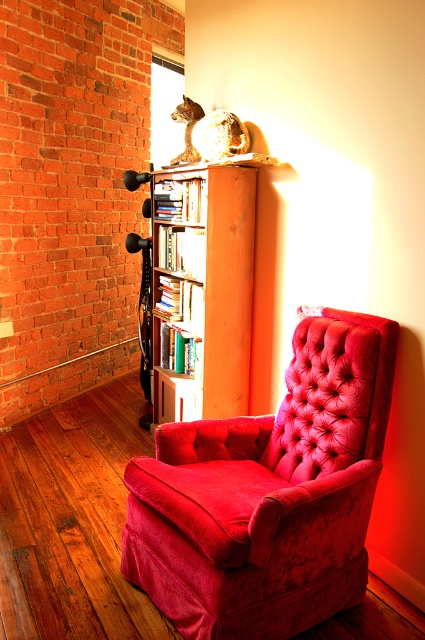
Question: Which of the following is the closest to the observer?

Choices:
 (A) wooden bookshelf at center
 (B) velvet red armchair at center

Answer: (B)

Question: Does velvet red armchair at center appear on the right side of wooden bookshelf at center?

Choices:
 (A) yes
 (B) no

Answer: (A)

Question: Can you confirm if velvet red armchair at center is wider than wooden bookshelf at center?

Choices:
 (A) no
 (B) yes

Answer: (B)

Question: Which of the following is the closest to the observer?

Choices:
 (A) (209, 356)
 (B) (198, 550)

Answer: (B)

Question: Does velvet red armchair at center have a greater width compared to wooden bookshelf at center?

Choices:
 (A) yes
 (B) no

Answer: (A)

Question: Which point appears closest to the camera in this image?

Choices:
 (A) (192, 508)
 (B) (246, 333)

Answer: (A)